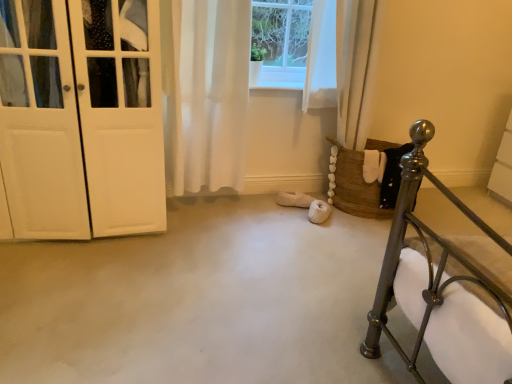
Question: From a real-world perspective, is white sheer curtain at center positioned above or below white matte door at left?

Choices:
 (A) below
 (B) above

Answer: (B)

Question: Is white sheer curtain at center taller or shorter than white matte door at left?

Choices:
 (A) short
 (B) tall

Answer: (A)

Question: Which is correct: white sheer curtain at center is inside white matte door at left, or outside of it?

Choices:
 (A) outside
 (B) inside

Answer: (A)

Question: From a real-world perspective, is white matte door at left above or below white sheer curtain at center?

Choices:
 (A) below
 (B) above

Answer: (A)

Question: Is white matte door at left spatially inside white sheer curtain at center, or outside of it?

Choices:
 (A) inside
 (B) outside

Answer: (B)

Question: Does point (56, 19) appear closer or farther from the camera than point (241, 41)?

Choices:
 (A) farther
 (B) closer

Answer: (B)

Question: Is white matte door at left taller or shorter than white sheer curtain at center?

Choices:
 (A) tall
 (B) short

Answer: (A)